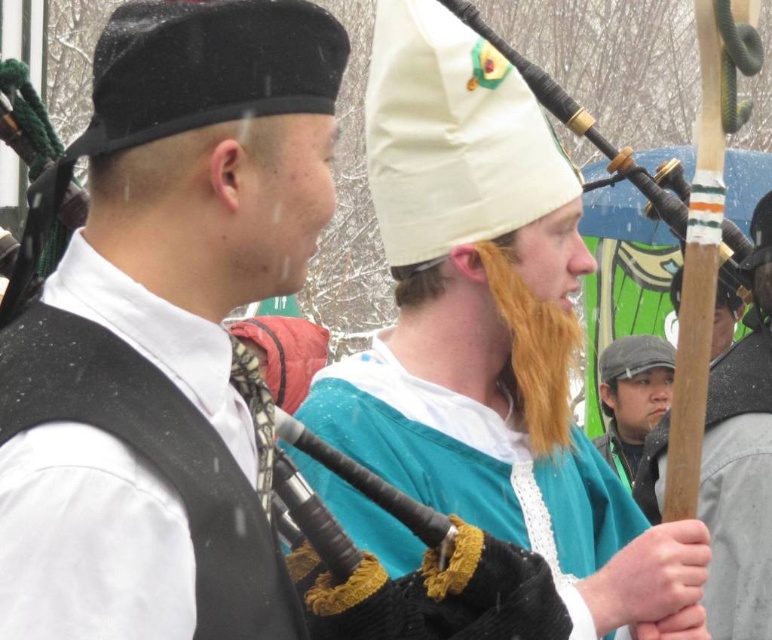
Question: Can you confirm if wooden stick at center is wider than wooden bagpipes at center?

Choices:
 (A) yes
 (B) no

Answer: (B)

Question: Is wooden bagpipes at center above matte gray cap at right?

Choices:
 (A) no
 (B) yes

Answer: (B)

Question: Does wooden stick at center appear on the left side of wooden bagpipes at center?

Choices:
 (A) yes
 (B) no

Answer: (A)

Question: Which of these objects is positioned farthest from the white cloth hat at center?

Choices:
 (A) matte gray cap at right
 (B) teal fabric bagpipe at center
 (C) wooden stick at center

Answer: (A)

Question: Estimate the real-world distances between objects in this image. Which object is farther from the teal fabric bagpipe at center?

Choices:
 (A) white cloth hat at center
 (B) wooden bagpipes at center

Answer: (A)

Question: Which point is farther to the camera?

Choices:
 (A) (566, 102)
 (B) (654, 356)
 (C) (486, 97)
 (D) (147, 282)

Answer: (B)